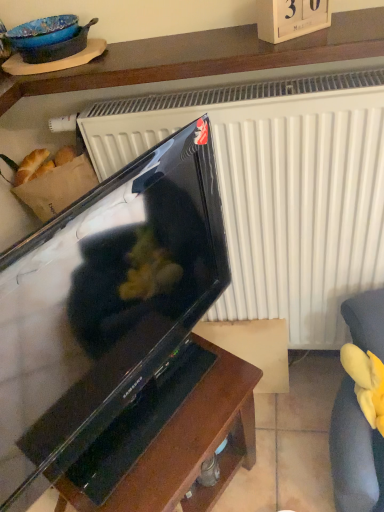
Question: From the image's perspective, is brown wood table at center on top of wooden shelf at upper center?

Choices:
 (A) no
 (B) yes

Answer: (A)

Question: Is brown wood table at center further to the viewer compared to wooden shelf at upper center?

Choices:
 (A) yes
 (B) no

Answer: (A)

Question: From the image's perspective, is brown wood table at center located beneath wooden shelf at upper center?

Choices:
 (A) no
 (B) yes

Answer: (B)

Question: Is brown wood table at center far away from wooden shelf at upper center?

Choices:
 (A) yes
 (B) no

Answer: (B)

Question: Would you say wooden shelf at upper center is part of brown wood table at center's contents?

Choices:
 (A) no
 (B) yes

Answer: (A)

Question: Does brown wood table at center turn towards wooden shelf at upper center?

Choices:
 (A) yes
 (B) no

Answer: (B)

Question: Is wooden shelf at upper center next to yellow plush toy at lower right and touching it?

Choices:
 (A) no
 (B) yes

Answer: (A)

Question: Is wooden shelf at upper center closer to camera compared to yellow plush toy at lower right?

Choices:
 (A) no
 (B) yes

Answer: (B)

Question: From the image's perspective, is wooden shelf at upper center over yellow plush toy at lower right?

Choices:
 (A) yes
 (B) no

Answer: (A)

Question: Considering the relative sizes of wooden shelf at upper center and yellow plush toy at lower right in the image provided, is wooden shelf at upper center taller than yellow plush toy at lower right?

Choices:
 (A) yes
 (B) no

Answer: (B)

Question: Is wooden shelf at upper center facing away from yellow plush toy at lower right?

Choices:
 (A) yes
 (B) no

Answer: (B)

Question: From a real-world perspective, does wooden shelf at upper center sit lower than yellow plush toy at lower right?

Choices:
 (A) no
 (B) yes

Answer: (A)

Question: Could you tell me if black glossy television at center is turned towards yellow plush toy at lower right?

Choices:
 (A) no
 (B) yes

Answer: (A)